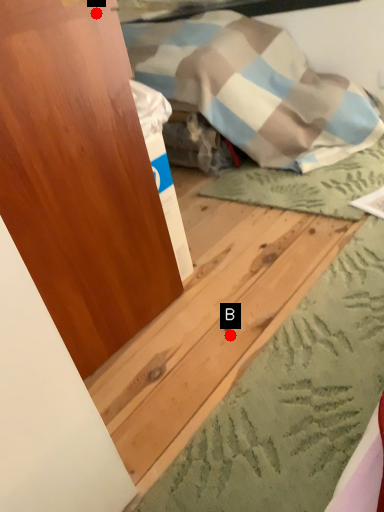
Question: Two points are circled on the image, labeled by A and B beside each circle. Which point is closer to the camera?

Choices:
 (A) A is closer
 (B) B is closer

Answer: (A)